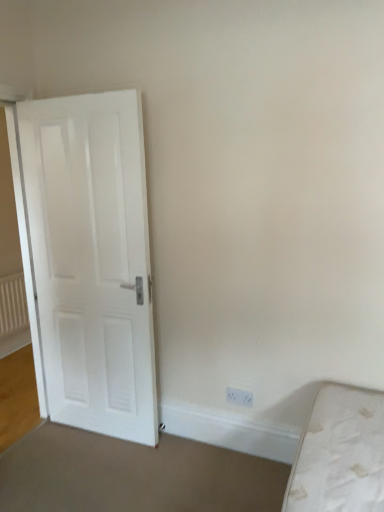
You are a GUI agent. You are given a task and a screenshot of the screen. Output one action in this format:
    pyautogui.click(x=<x>, y=<y>)
    Task: Click on the vacant region under white matte door at left (from a real-world perspective)
    The image size is (384, 512).
    Given the screenshot: What is the action you would take?
    pyautogui.click(x=100, y=436)